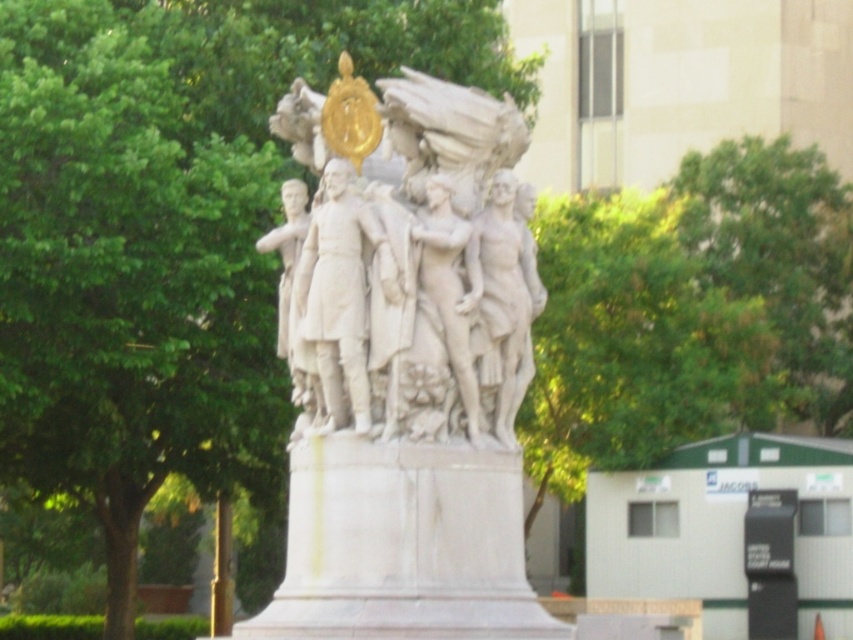
Question: Is white marble statue at center below green leafy tree at upper center?

Choices:
 (A) yes
 (B) no

Answer: (A)

Question: Can you confirm if white marble statue at center is positioned to the left of green leafy tree at upper center?

Choices:
 (A) no
 (B) yes

Answer: (B)

Question: In this image, where is white marble statue at center located relative to green leafy tree at upper center?

Choices:
 (A) right
 (B) left

Answer: (B)

Question: Which point appears farthest from the camera in this image?

Choices:
 (A) (843, 260)
 (B) (518, 273)

Answer: (A)

Question: Which point appears farthest from the camera in this image?

Choices:
 (A) (538, 298)
 (B) (747, 195)

Answer: (B)